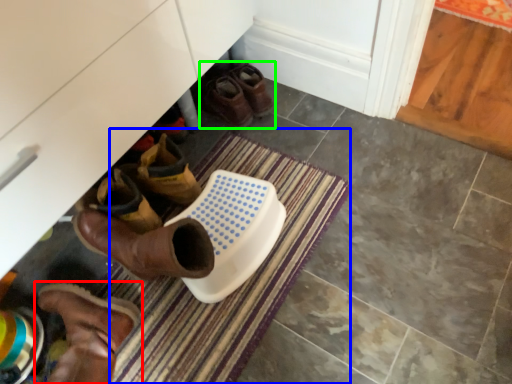
Question: Which object is the closest to the footwear (highlighted by a red box)? Choose among these: bath mat (highlighted by a blue box) or footwear (highlighted by a green box).

Choices:
 (A) bath mat
 (B) footwear

Answer: (A)